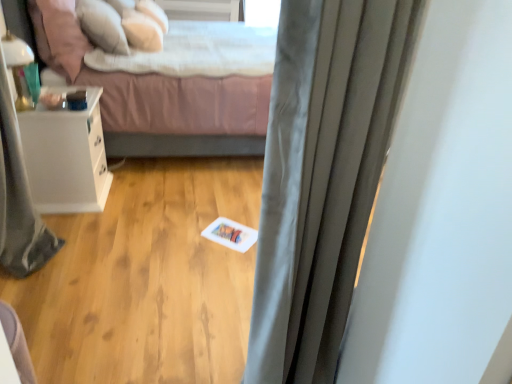
At what (x,y) coordinates should I click in order to perform the action: click on vacant space in between white glossy nightstand at left and white matte card at center. Please return your answer as a coordinate pair (x, y). The image size is (512, 384). Looking at the image, I should click on (147, 220).